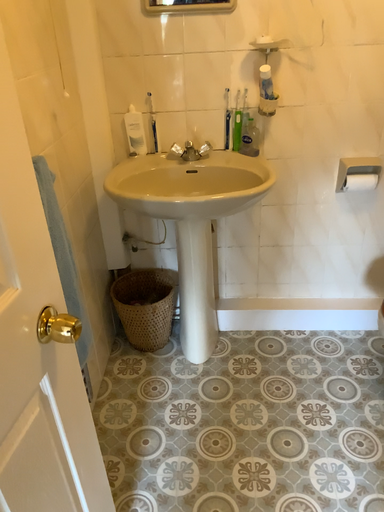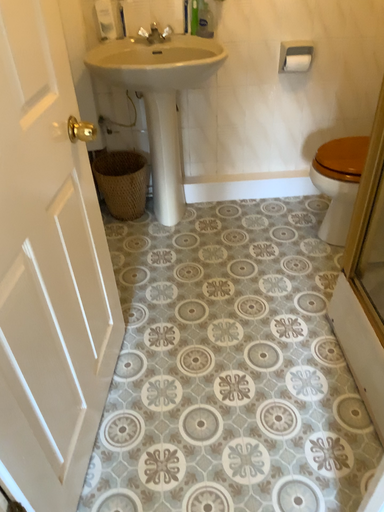
Question: How did the camera likely rotate when shooting the video?

Choices:
 (A) rotated upward
 (B) rotated downward

Answer: (B)